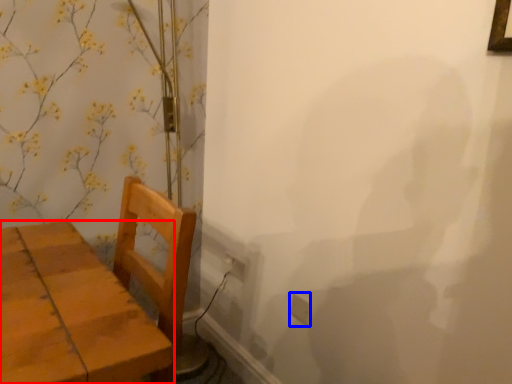
Question: Which of the following is the farthest to the observer, furniture (highlighted by a red box) or electric outlet (highlighted by a blue box)?

Choices:
 (A) furniture
 (B) electric outlet

Answer: (B)